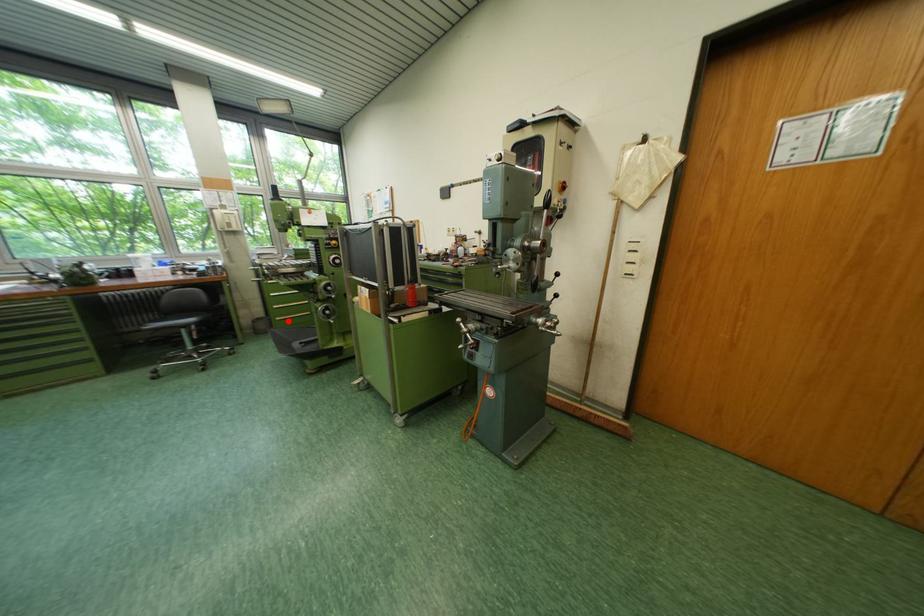
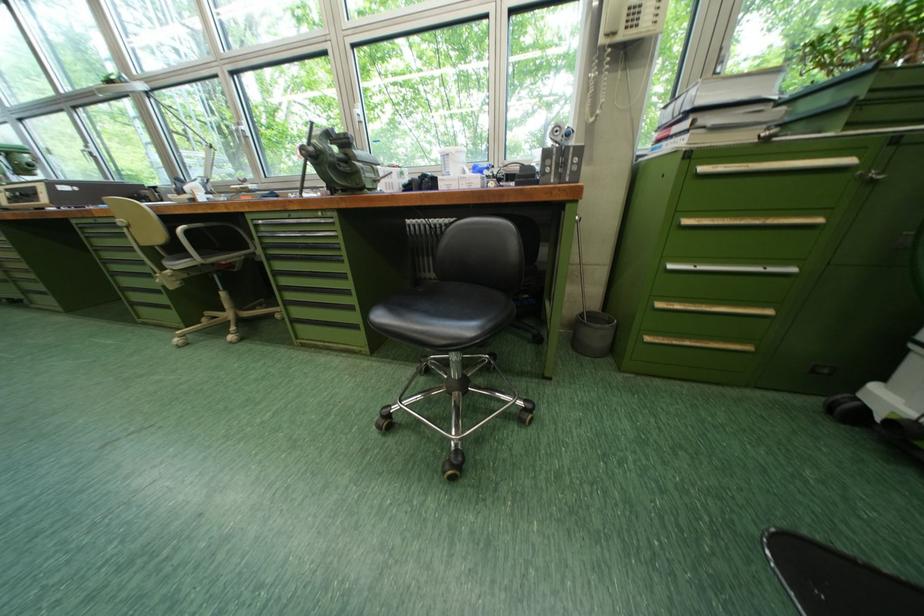
Where in the second image is the point corresponding to the highlighted location from the first image?

(659, 341)